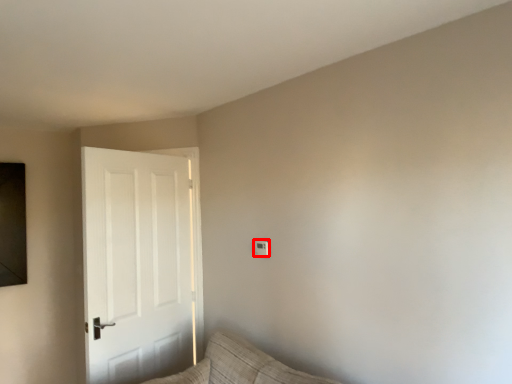
Question: From the image's perspective, what is the correct spatial positioning of light switch (annotated by the red box) in reference to door?

Choices:
 (A) above
 (B) below

Answer: (A)